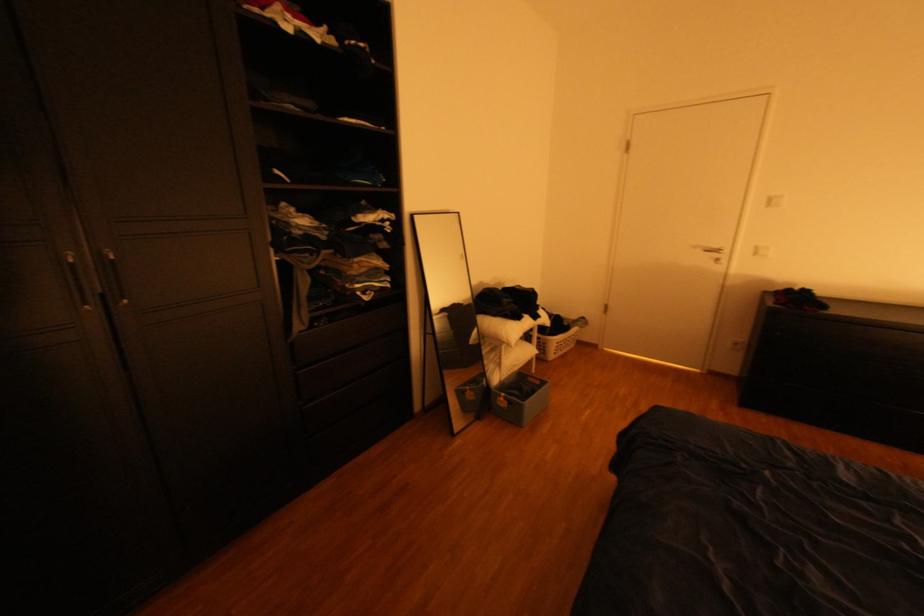
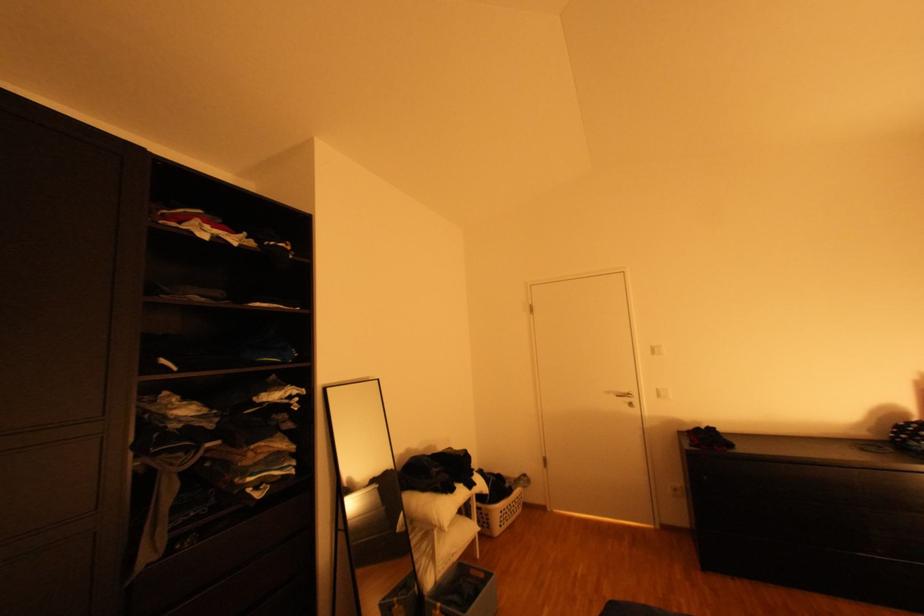
Locate, in the second image, the point that corresponds to pixel 572 345 in the first image.

(516, 513)